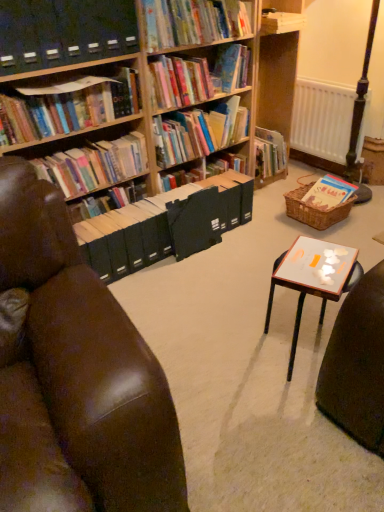
The height and width of the screenshot is (512, 384). Find the location of `vacant space situated on the left part of white glossy table at center`. vacant space situated on the left part of white glossy table at center is located at coordinates (215, 354).